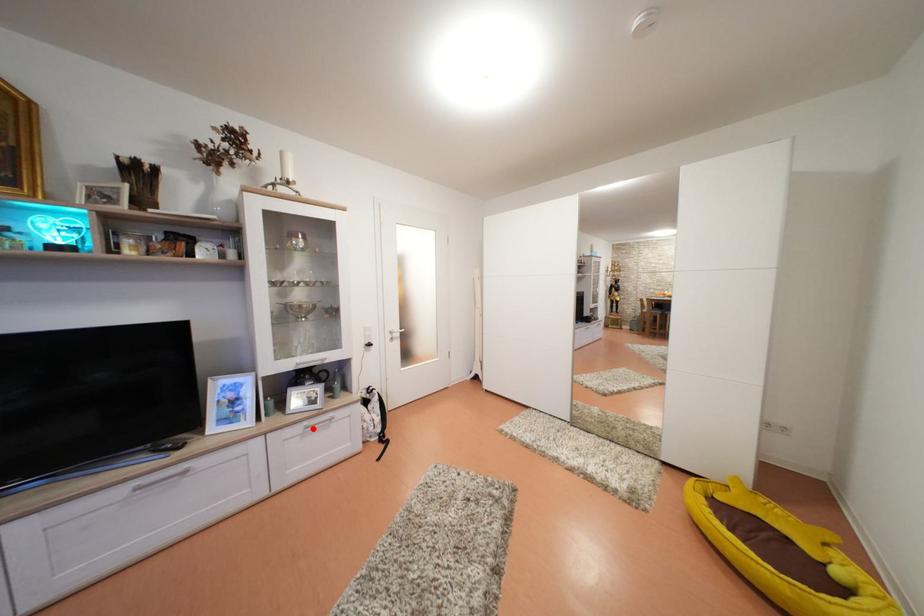
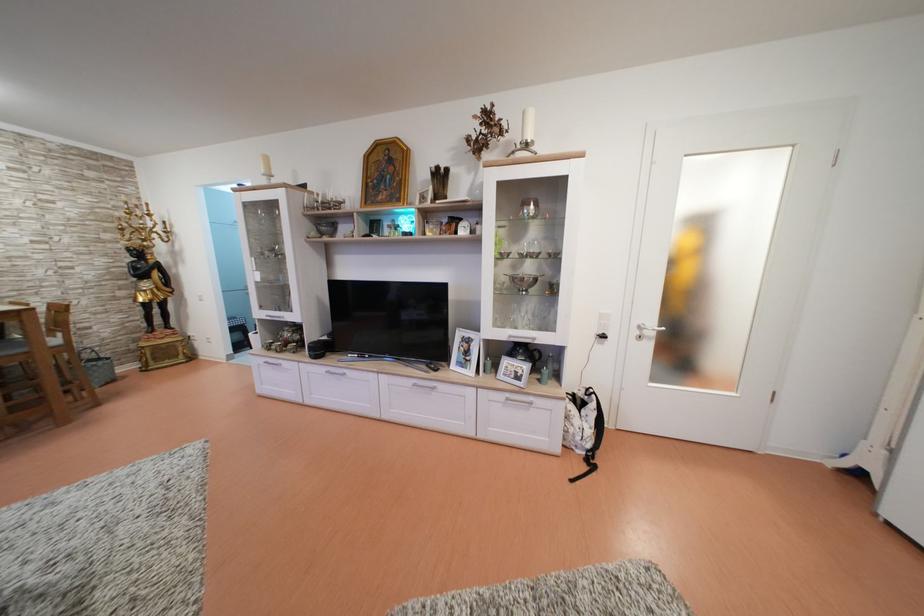
Find the pixel in the second image that matches the highlighted location in the first image.

(515, 400)